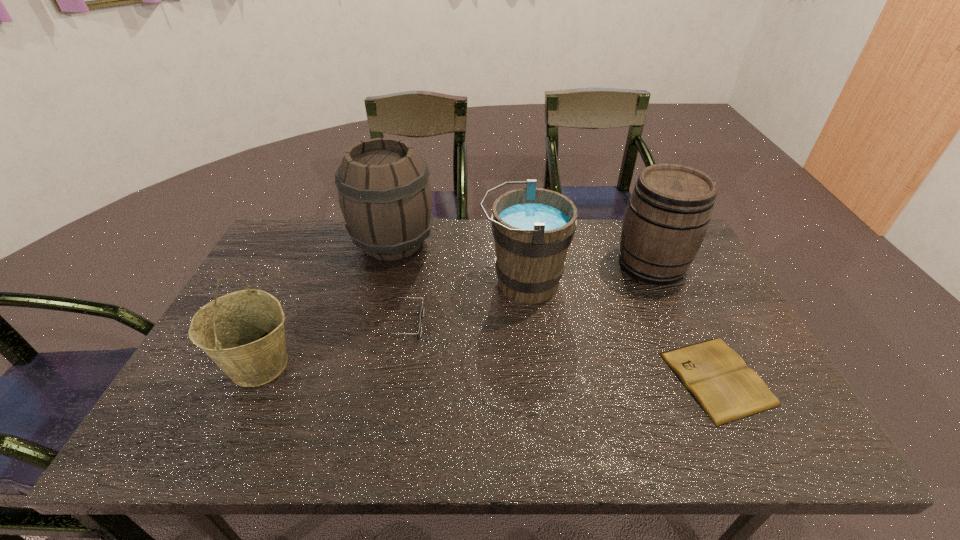
Find the location of `the third wine bucket from right to left`. the third wine bucket from right to left is located at coordinates [x=385, y=196].

Where is `the rightmost wine bucket`? the rightmost wine bucket is located at coordinates pos(669,211).

This screenshot has width=960, height=540. What are the coordinates of `the fourth object from left to right` in the screenshot? It's located at (533, 227).

The height and width of the screenshot is (540, 960). What are the coordinates of `the leftmost object` in the screenshot? It's located at (242, 332).

Find the location of a particular element. the leftmost wine bucket is located at coordinates (242, 332).

Find the location of `sunglasses`. sunglasses is located at coordinates click(x=422, y=311).

At what (x,y) coordinates should I click in order to perform the action: click on the shortest object. Please return your answer as a coordinate pair (x, y). The width and height of the screenshot is (960, 540). Looking at the image, I should click on (718, 378).

This screenshot has width=960, height=540. Identify the location of vacant area situated on the right of the second wine bucket from left to right. (549, 242).

This screenshot has height=540, width=960. What are the coordinates of `free space located 0.260m on the front of the rightmost wine bucket` in the screenshot? It's located at (695, 359).

You are a GUI agent. You are given a task and a screenshot of the screen. Output one action in this format:
    pyautogui.click(x=<x>, y=<y>)
    Task: Click on the vacant space situated 0.300m with a handle on the side of the third object from right to left
    
    Given the screenshot: What is the action you would take?
    pyautogui.click(x=379, y=283)